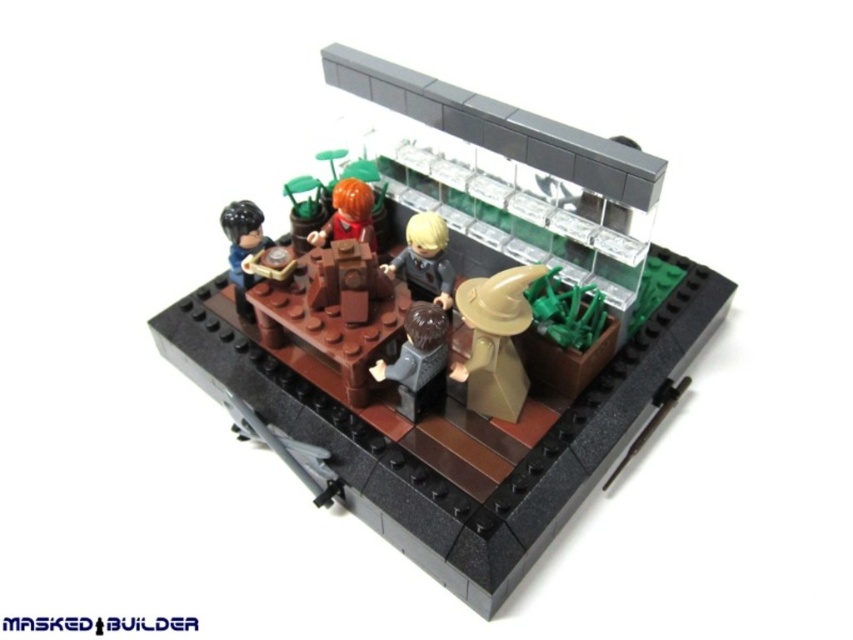
Question: Is the position of matte brown wizard hat at lower right less distant than that of orange hair minifigure at center?

Choices:
 (A) no
 (B) yes

Answer: (B)

Question: Which point appears farthest from the camera in this image?

Choices:
 (A) (428, 244)
 (B) (473, 356)
 (C) (570, 225)

Answer: (A)

Question: Which point is farther to the camera?

Choices:
 (A) (415, 419)
 (B) (502, 342)

Answer: (A)

Question: Is smooth brown hair at center further to camera compared to orange hair minifigure at center?

Choices:
 (A) yes
 (B) no

Answer: (B)

Question: Can you confirm if smooth black hair at left is bigger than orange hair minifigure at center?

Choices:
 (A) yes
 (B) no

Answer: (A)

Question: Estimate the real-world distances between objects in this image. Which object is farther from the matte brown wizard hat at lower right?

Choices:
 (A) smooth black hair at left
 (B) orange hair minifigure at center

Answer: (A)